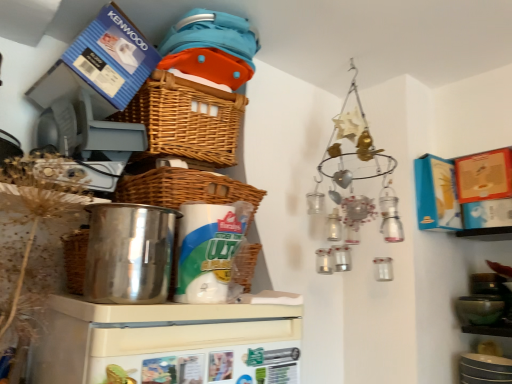
Question: In terms of height, does polished stainless steel pot at left, the first appliance from the top, look taller or shorter compared to woven brown basket at upper center, which ranks as the 1th basket in top-to-bottom order?

Choices:
 (A) short
 (B) tall

Answer: (A)

Question: Considering the positions of point (155, 279) and point (217, 100), is point (155, 279) closer or farther from the camera than point (217, 100)?

Choices:
 (A) farther
 (B) closer

Answer: (B)

Question: Which is farther from the white plastic refrigerator at center, which ranks as the first appliance in bottom-to-top order?

Choices:
 (A) polished stainless steel pot at left, the first appliance from the top
 (B) woven brown basket at upper center, positioned as the second basket in bottom-to-top order
 (C) woven brown basket at center, the 2th basket positioned from the top

Answer: (B)

Question: Which is farther from the polished stainless steel pot at left, the first appliance from the top?

Choices:
 (A) woven brown basket at upper center, which ranks as the 1th basket in top-to-bottom order
 (B) white plastic refrigerator at center, which ranks as the first appliance in bottom-to-top order
 (C) woven brown basket at center, which is the first basket from bottom to top

Answer: (A)